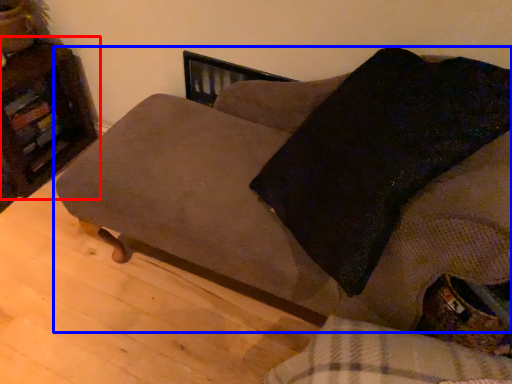
Question: Which point is closer to the camera, furniture (highlighted by a red box) or studio couch (highlighted by a blue box)?

Choices:
 (A) furniture
 (B) studio couch

Answer: (B)